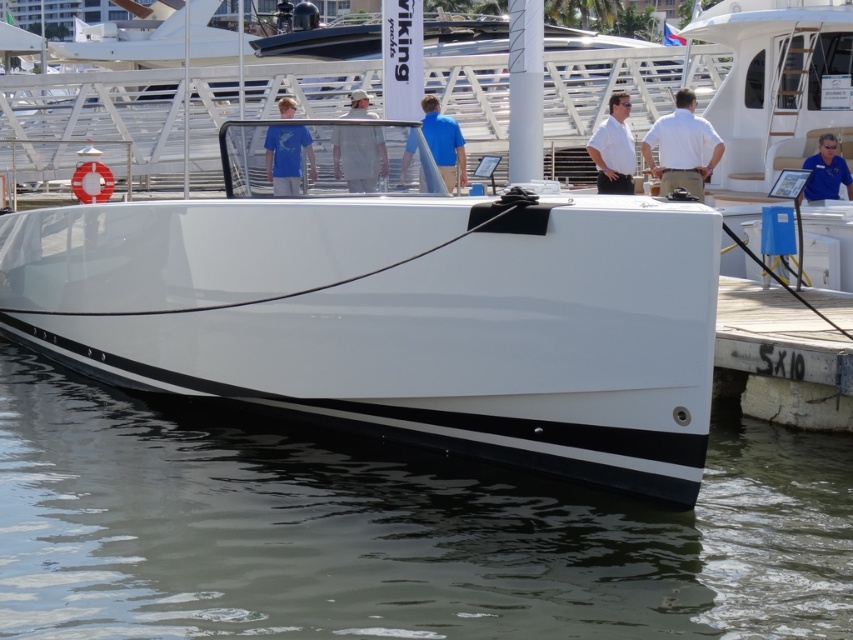
Question: Which is nearer to the white glossy boat at center?

Choices:
 (A) blue glossy shirt at upper right
 (B) white matte shirt at center
 (C) white matte shirt at upper center

Answer: (A)

Question: Can you confirm if glossy white water at lower center is positioned to the left of matte blue shirt at upper center?

Choices:
 (A) yes
 (B) no

Answer: (A)

Question: Is white glossy boat at center positioned at the back of blue glossy shirt at upper right?

Choices:
 (A) no
 (B) yes

Answer: (A)

Question: Among these objects, which one is nearest to the camera?

Choices:
 (A) matte blue shirt at upper center
 (B) white glossy boat at center
 (C) glossy white water at lower center
 (D) matte blue shirt at center

Answer: (C)

Question: Which object is farther from the camera taking this photo?

Choices:
 (A) white glossy boat at center
 (B) white cotton shirt at center
 (C) matte blue shirt at upper center

Answer: (B)

Question: Is white matte shirt at upper center below matte blue shirt at upper center?

Choices:
 (A) yes
 (B) no

Answer: (B)